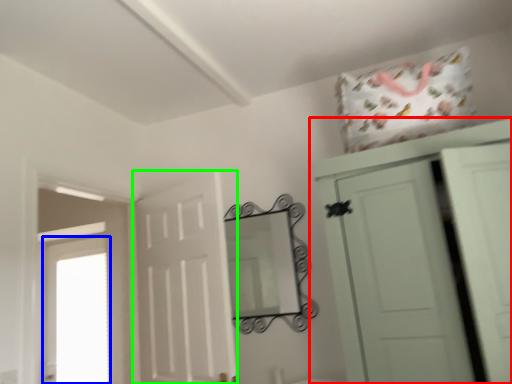
Question: Based on their relative distances, which object is nearer to cupboard (highlighted by a red box)? Choose from window (highlighted by a blue box) and door (highlighted by a green box).

Choices:
 (A) window
 (B) door

Answer: (B)